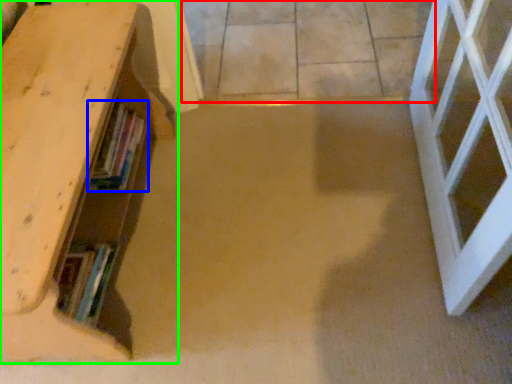
Question: Based on their relative distances, which object is nearer to concrete (highlighted by a red box)? Choose from book (highlighted by a blue box) and shelf (highlighted by a green box).

Choices:
 (A) book
 (B) shelf

Answer: (B)